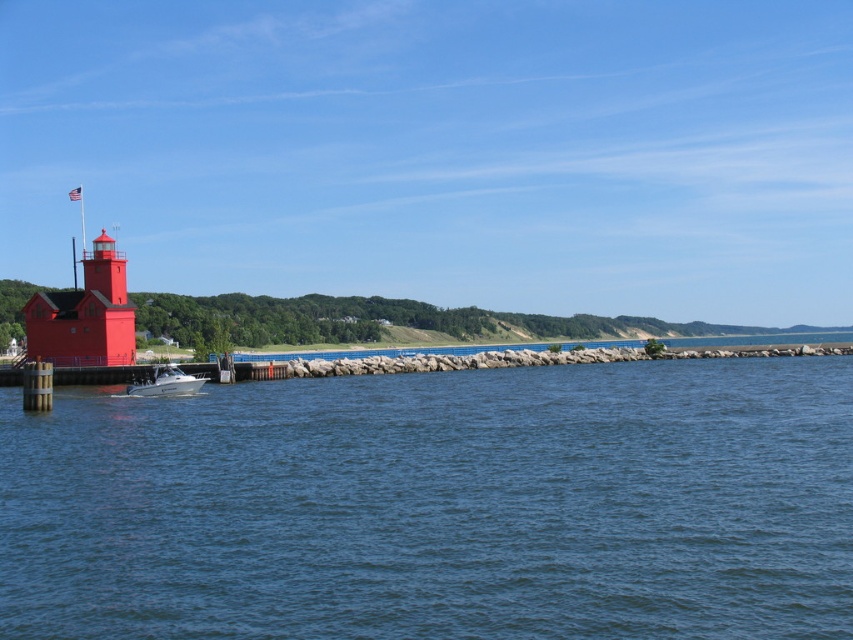
You are a photographer aiming to capture the white glossy boat at lower left and the blue water at center in the same frame. Based on their positions, which object should you focus on first to ensure both are in the shot?

The white glossy boat at lower left should be focused on first since the blue water at center is positioned to its right, meaning the boat is closer to the left edge of the frame and the water is further right. By starting with the boat, you can adjust the camera to include both elements in the composition.

You are a photographer planning to capture the blue water at center and the white glossy boat at lower left in a single shot. Based on their positions, will the boat appear above or below the water in your photo?

The blue water at center is located below the white glossy boat at lower left, so in the photo, the boat will appear above the water.